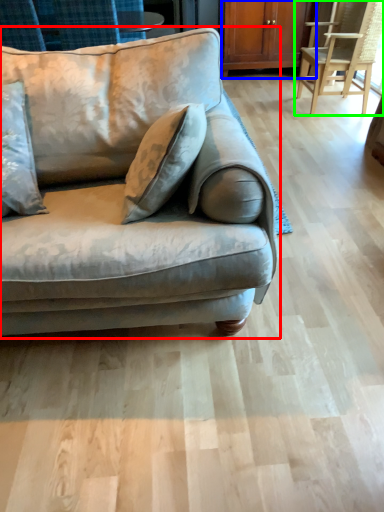
Question: Which object is the closest to the studio couch (highlighted by a red box)? Choose among these: dresser (highlighted by a blue box) or chair (highlighted by a green box).

Choices:
 (A) dresser
 (B) chair

Answer: (B)